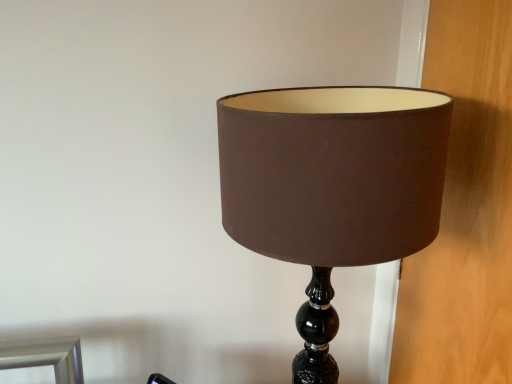
What are the coordinates of `matte brown lampshade at center` in the screenshot? It's located at (332, 187).

What do you see at coordinates (332, 187) in the screenshot?
I see `matte brown lampshade at center` at bounding box center [332, 187].

Identify the location of matte brown lampshade at center. (332, 187).